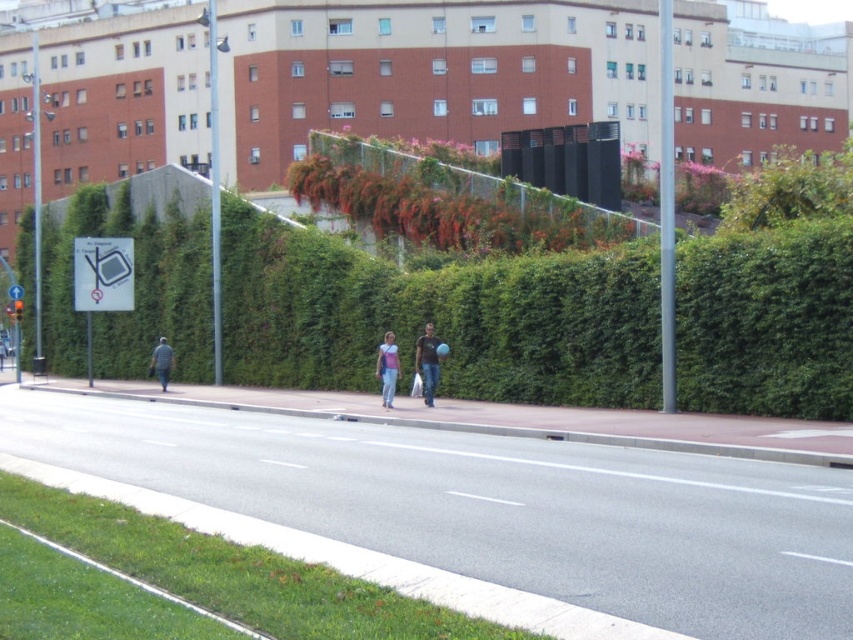
Question: Is green leafy bush at upper center to the left of blue denim jacket at left from the viewer's perspective?

Choices:
 (A) yes
 (B) no

Answer: (B)

Question: Is green leafy hedge at center thinner than green leafy bush at upper center?

Choices:
 (A) yes
 (B) no

Answer: (B)

Question: Does green leafy hedge at center lie behind denim jeans at center?

Choices:
 (A) no
 (B) yes

Answer: (A)

Question: Which object is the closest to the green leafy bush at upper center?

Choices:
 (A) blue denim jacket at left
 (B) white plastic sign at left

Answer: (A)

Question: Which object is farther from the camera taking this photo?

Choices:
 (A) matte pink shirt at center
 (B) green leafy bush at upper center
 (C) white plastic sign at left
 (D) blue denim jacket at left

Answer: (C)

Question: Which point appears closest to the camera in this image?

Choices:
 (A) (22, 296)
 (B) (514, 224)
 (C) (236, 272)

Answer: (B)